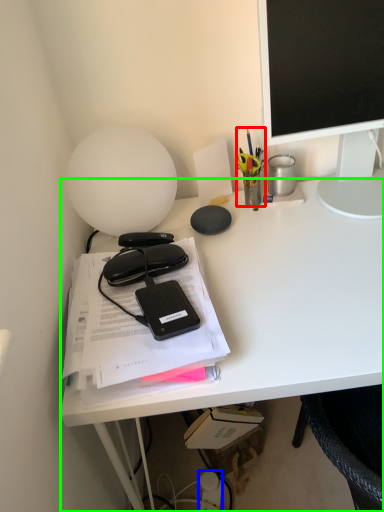
Question: Considering the real-world distances, which object is farthest from stationery (highlighted by a red box)? stationery (highlighted by a blue box) or desk (highlighted by a green box)?

Choices:
 (A) stationery
 (B) desk

Answer: (A)